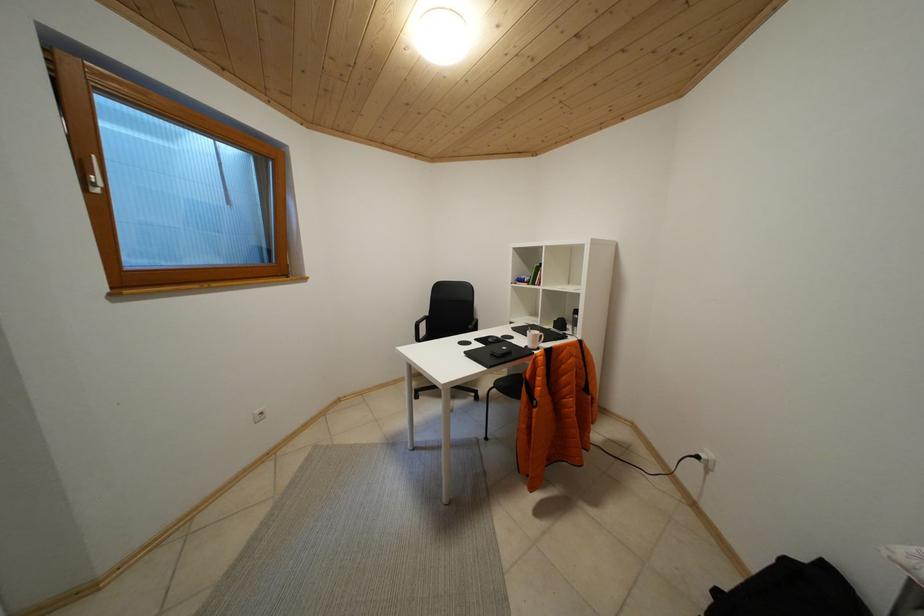
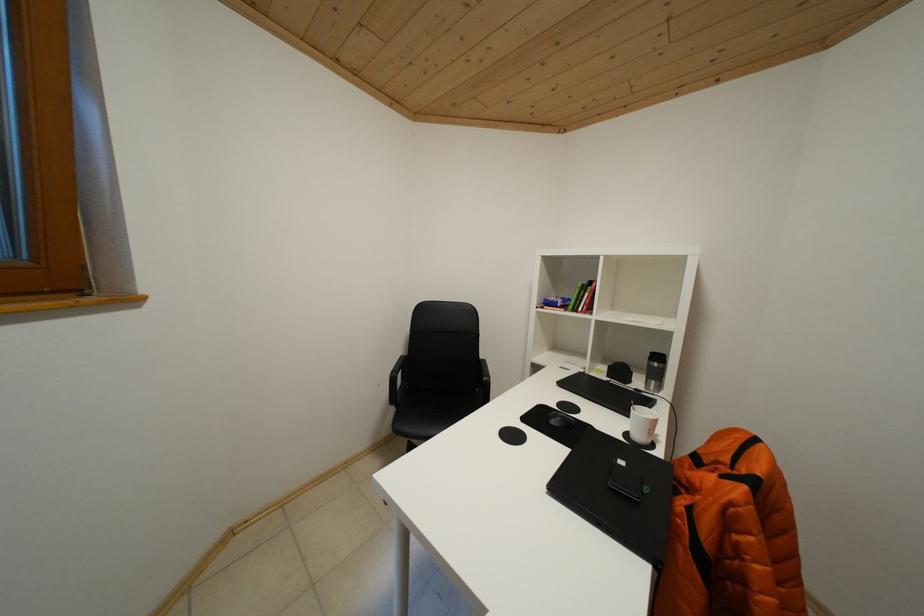
Which direction would the cameraman need to move to produce the second image?

The cameraman walked toward left, forward.